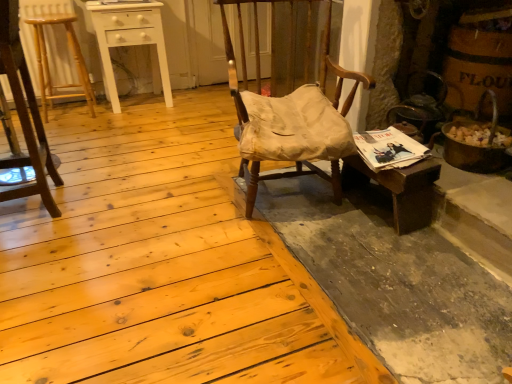
Question: Considering the relative sizes of light brown wood bar stool at left and wooden stool at left, the first chair in the left-to-right sequence, in the image provided, is light brown wood bar stool at left shorter than wooden stool at left, the first chair in the left-to-right sequence,?

Choices:
 (A) no
 (B) yes

Answer: (B)

Question: Does light brown wood bar stool at left have a lesser width compared to wooden stool at left, which is the 2th chair in right-to-left order?

Choices:
 (A) yes
 (B) no

Answer: (B)

Question: From a real-world perspective, is light brown wood bar stool at left physically above wooden stool at left, which is the 2th chair in right-to-left order?

Choices:
 (A) no
 (B) yes

Answer: (A)

Question: Considering the relative sizes of light brown wood bar stool at left and wooden stool at left, the first chair in the left-to-right sequence, in the image provided, is light brown wood bar stool at left bigger than wooden stool at left, the first chair in the left-to-right sequence,?

Choices:
 (A) no
 (B) yes

Answer: (A)

Question: Considering the relative sizes of light brown wood bar stool at left and wooden stool at left, which is the 2th chair in right-to-left order, in the image provided, is light brown wood bar stool at left taller than wooden stool at left, which is the 2th chair in right-to-left order,?

Choices:
 (A) yes
 (B) no

Answer: (B)

Question: From a real-world perspective, is wooden chair with worn fabric cushion at center, the first chair in the right-to-left sequence, physically located above or below wooden desk at right?

Choices:
 (A) above
 (B) below

Answer: (A)

Question: Considering the positions of point (330, 3) and point (436, 173), is point (330, 3) closer or farther from the camera than point (436, 173)?

Choices:
 (A) farther
 (B) closer

Answer: (A)

Question: Based on their sizes in the image, would you say wooden chair with worn fabric cushion at center, the second chair positioned from the left, is bigger or smaller than wooden desk at right?

Choices:
 (A) big
 (B) small

Answer: (A)

Question: Is wooden chair with worn fabric cushion at center, the first chair in the right-to-left sequence, inside the boundaries of wooden desk at right, or outside?

Choices:
 (A) inside
 (B) outside

Answer: (B)

Question: Looking at the image, does wooden stool at left, the first chair in the left-to-right sequence, seem bigger or smaller compared to white wood table at upper left?

Choices:
 (A) big
 (B) small

Answer: (B)

Question: From their relative heights in the image, would you say wooden stool at left, the first chair in the left-to-right sequence, is taller or shorter than white wood table at upper left?

Choices:
 (A) tall
 (B) short

Answer: (A)

Question: Looking at their shapes, would you say wooden stool at left, the first chair in the left-to-right sequence, is wider or thinner than white wood table at upper left?

Choices:
 (A) wide
 (B) thin

Answer: (B)

Question: From a real-world perspective, is wooden stool at left, the first chair in the left-to-right sequence, physically located above or below white wood table at upper left?

Choices:
 (A) below
 (B) above

Answer: (B)

Question: From the image's perspective, is wooden desk at right located above or below wooden chair with worn fabric cushion at center, the second chair positioned from the left?

Choices:
 (A) above
 (B) below

Answer: (B)

Question: Is wooden desk at right inside the boundaries of wooden chair with worn fabric cushion at center, the second chair positioned from the left, or outside?

Choices:
 (A) inside
 (B) outside

Answer: (B)